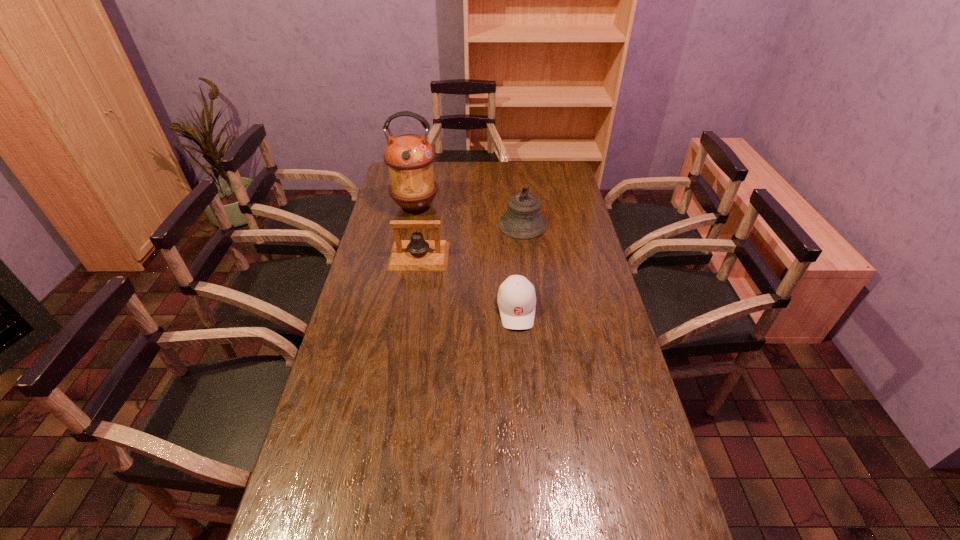
Where is `free space located 0.310m on the front-facing side of the baseball cap`? free space located 0.310m on the front-facing side of the baseball cap is located at coordinates (526, 420).

The image size is (960, 540). What are the coordinates of `oil lamp that is at the left edge` in the screenshot? It's located at click(x=409, y=157).

This screenshot has width=960, height=540. Find the location of `bell that is at the left edge`. bell that is at the left edge is located at coordinates (417, 254).

The height and width of the screenshot is (540, 960). Identify the location of object that is at the right edge. (523, 220).

Find the location of a particular element. This screenshot has width=960, height=540. vacant region at the left edge is located at coordinates (348, 444).

In the image, there is a desktop. Where is `free space at the right edge`? Image resolution: width=960 pixels, height=540 pixels. free space at the right edge is located at coordinates (587, 375).

This screenshot has width=960, height=540. In order to click on vacant area between the tallest object and the baseball cap in this screenshot , I will do `click(466, 258)`.

At what (x,y) coordinates should I click in order to perform the action: click on vacant space that's between the second nearest object and the farther bell. Please return your answer as a coordinate pair (x, y). The width and height of the screenshot is (960, 540). Looking at the image, I should click on (470, 241).

Locate an element on the screen. This screenshot has height=540, width=960. vacant region between the shorter bell and the second tallest object is located at coordinates (470, 241).

Locate an element on the screen. vacant point located between the oil lamp and the right bell is located at coordinates (468, 215).